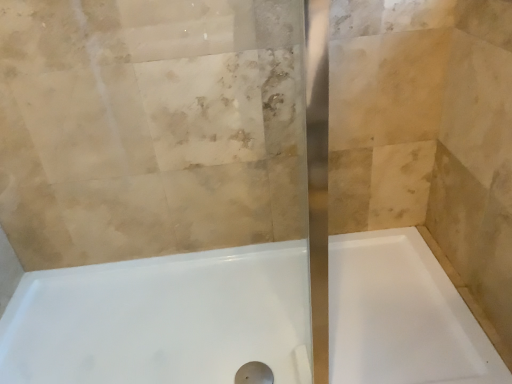
What are the coordinates of `white glossy bathtub at lower center` in the screenshot? It's located at (159, 318).

Describe the element at coordinates (159, 318) in the screenshot. This screenshot has width=512, height=384. I see `white glossy bathtub at lower center` at that location.

Locate an element on the screen. This screenshot has width=512, height=384. white glossy bathtub at lower center is located at coordinates pyautogui.click(x=159, y=318).